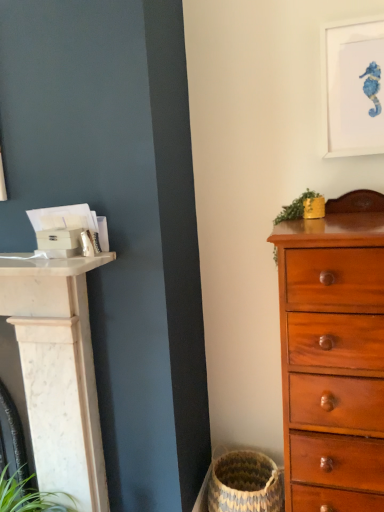
Question: From the image's perspective, relative to green leafy plant at upper right, is white matte picture frame at upper right above or below?

Choices:
 (A) below
 (B) above

Answer: (B)

Question: Considering the relative positions of white matte picture frame at upper right and green leafy plant at upper right in the image provided, is white matte picture frame at upper right to the left or to the right of green leafy plant at upper right?

Choices:
 (A) left
 (B) right

Answer: (B)

Question: Estimate the real-world distances between objects in this image. Which object is farther from the green leafy plant at upper right?

Choices:
 (A) mahogany wooden chest of drawers at right
 (B) natural woven basket at lower center
 (C) white matte picture frame at upper right

Answer: (B)

Question: Which of these objects is positioned farthest from the natural woven basket at lower center?

Choices:
 (A) green leafy plant at upper right
 (B) mahogany wooden chest of drawers at right
 (C) white matte picture frame at upper right

Answer: (C)